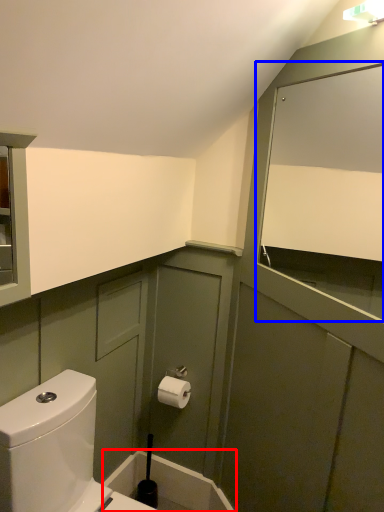
Question: Which object is further to the camera taking this photo, bath (highlighted by a red box) or mirror (highlighted by a blue box)?

Choices:
 (A) bath
 (B) mirror

Answer: (A)